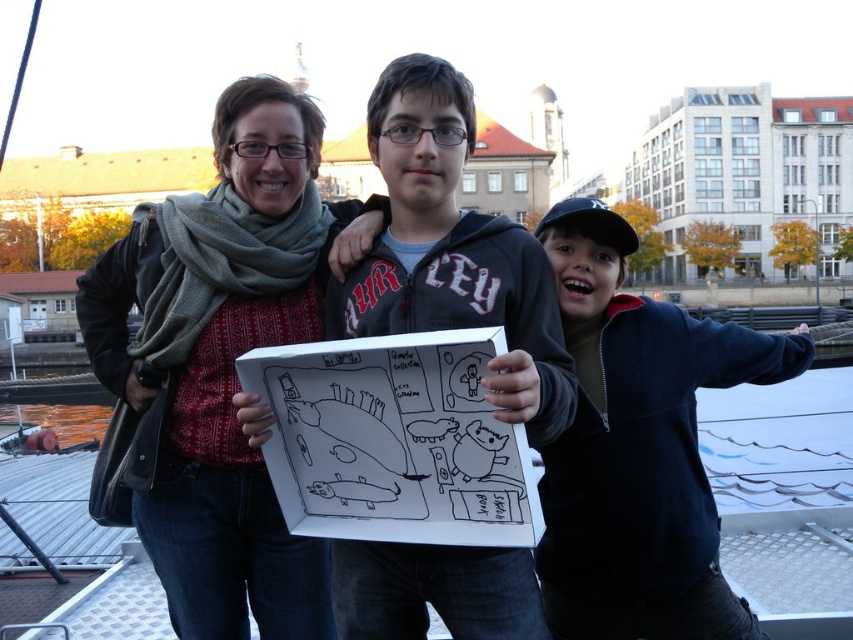
Question: Is matte gray scarf at center thinner than matte black hoodie at center?

Choices:
 (A) no
 (B) yes

Answer: (B)

Question: Can you confirm if matte gray scarf at center is wider than dark blue fleece jacket at center?

Choices:
 (A) yes
 (B) no

Answer: (B)

Question: Which point is closer to the camera?

Choices:
 (A) matte black hoodie at center
 (B) dark blue fleece jacket at center
 (C) matte gray scarf at center

Answer: (A)

Question: Which object appears closest to the camera in this image?

Choices:
 (A) matte black hoodie at center
 (B) matte gray scarf at center

Answer: (A)

Question: Is matte gray scarf at center to the right of matte black hoodie at center from the viewer's perspective?

Choices:
 (A) yes
 (B) no

Answer: (B)

Question: Which of these objects is positioned farthest from the matte gray scarf at center?

Choices:
 (A) matte black hoodie at center
 (B) dark blue fleece jacket at center

Answer: (B)